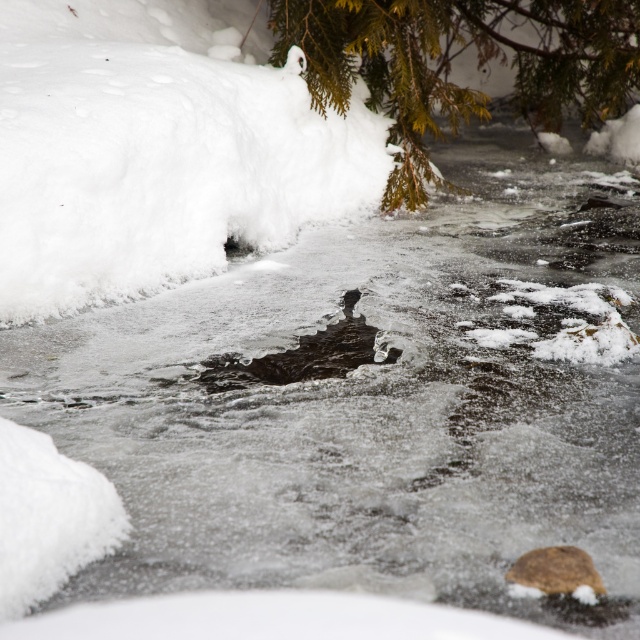
You are a hiker who needs to cross the frozen stream. You see the white fluffy snow at center and the green textured branch at upper center in the scene. How far apart are these two landmarks?

The white fluffy snow at center and the green textured branch at upper center are 4.47 meters apart.

You are an observer looking at the winter scene. You see the white fluffy snow at center and the green textured branch at upper center. Which object is closer to you?

The white fluffy snow at center is closer to you because it is positioned in front of the green textured branch at upper center.

You are a hiker trying to cross the frozen stream. You see the white fluffy snow at center and the green textured branch at upper center. Which object is closer to your current position?

The white fluffy snow at center is closer to your current position because it is located to the left of the green textured branch at upper center, which is further away.